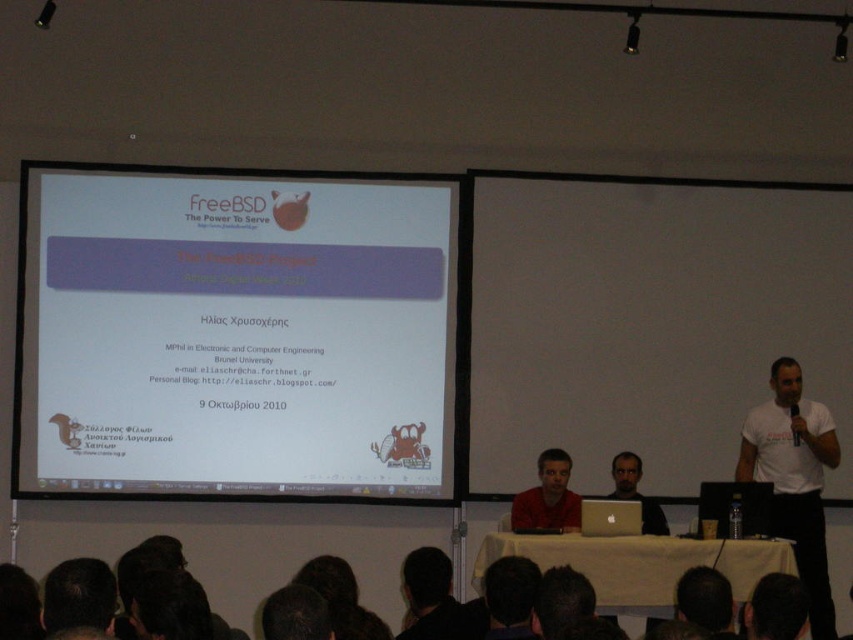
Question: Is white t-shirt at right wider than black matte head at lower center?

Choices:
 (A) yes
 (B) no

Answer: (A)

Question: Which object is the closest to the matte black laptop at center?

Choices:
 (A) white t-shirt at right
 (B) white matte projector screen at center
 (C) silver metallic laptop at center
 (D) black matte head at lower center

Answer: (C)

Question: Which object is positioned closest to the matte red shirt at center?

Choices:
 (A) white t-shirt at right
 (B) matte black laptop at center

Answer: (B)

Question: Which is farther from the white matte projector screen at center?

Choices:
 (A) matte red shirt at center
 (B) silver metallic laptop at center
 (C) black matte head at lower center
 (D) white t-shirt at right

Answer: (D)

Question: Considering the relative positions of black matte head at lower center and matte black laptop at center in the image provided, where is black matte head at lower center located with respect to matte black laptop at center?

Choices:
 (A) above
 (B) below

Answer: (B)

Question: Is white matte projector screen at center smaller than silver metallic laptop at center?

Choices:
 (A) yes
 (B) no

Answer: (B)